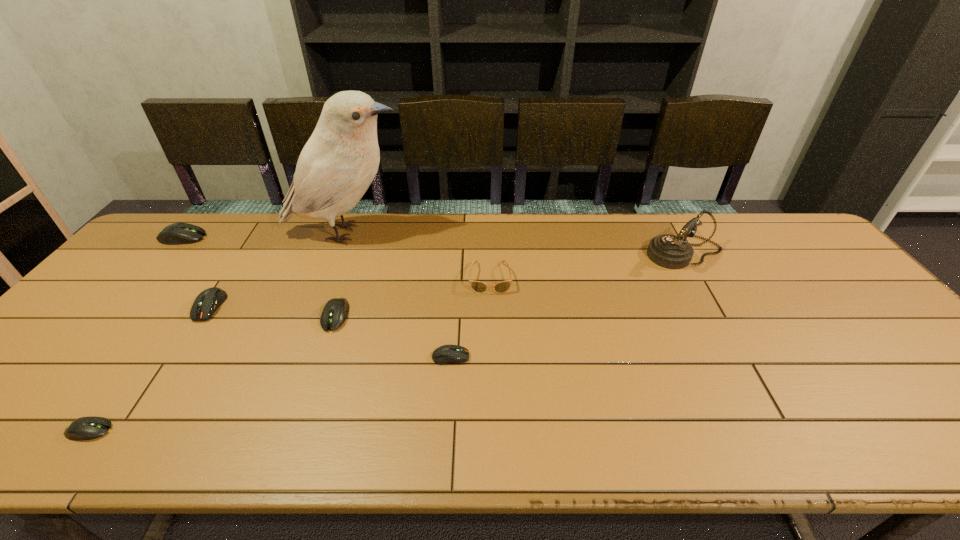
The image size is (960, 540). What are the coordinates of `free point located 0.250m on the wheel side of the rightmost gray computer mouse` in the screenshot? It's located at (300, 421).

This screenshot has width=960, height=540. What are the coordinates of `free spot located 0.230m on the button of the second nearest object` in the screenshot? It's located at (564, 357).

Image resolution: width=960 pixels, height=540 pixels. Identify the location of vacant point located 0.130m on the wheel side of the second object from left to right. (174, 430).

Find the location of a particular element. The image size is (960, 540). parakeet located at the far edge is located at coordinates (338, 163).

At what (x,y) coordinates should I click in order to perform the action: click on telephone that is at the far edge. Please return your answer as a coordinate pair (x, y). The width and height of the screenshot is (960, 540). Looking at the image, I should click on (669, 251).

I want to click on computer mouse positioned at the far edge, so click(x=177, y=233).

You are a GUI agent. You are given a task and a screenshot of the screen. Output one action in this format:
    pyautogui.click(x=<x>, y=<y>)
    Task: Click on the object that is at the near edge
    The width and height of the screenshot is (960, 540).
    Given the screenshot: What is the action you would take?
    pyautogui.click(x=85, y=428)

Where is `object situated at the left edge`? This screenshot has width=960, height=540. object situated at the left edge is located at coordinates (177, 233).

Image resolution: width=960 pixels, height=540 pixels. I want to click on object located at the far left corner, so click(177, 233).

Where is `free space at the far edge of the desktop`? free space at the far edge of the desktop is located at coordinates (491, 244).